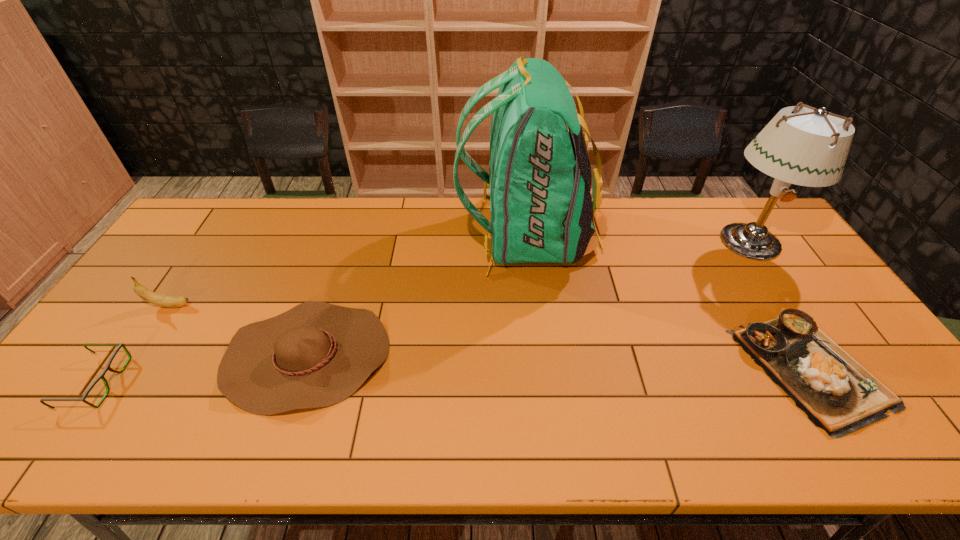
You are a GUI agent. You are given a task and a screenshot of the screen. Output one action in this format:
    pyautogui.click(x=<x>, y=<y>)
    Task: Click on the backpack
    
    Given the screenshot: What is the action you would take?
    pyautogui.click(x=541, y=209)

The image size is (960, 540). What are the coordinates of `the third object from right to left` in the screenshot? It's located at (541, 209).

Locate an element on the screen. the second tallest object is located at coordinates (809, 148).

Image resolution: width=960 pixels, height=540 pixels. In order to click on banana in this screenshot , I will do `click(157, 299)`.

At what (x,y) coordinates should I click in order to perform the action: click on the third object from left to right. Please return your answer as a coordinate pair (x, y). Looking at the image, I should click on (317, 354).

You are a GUI agent. You are given a task and a screenshot of the screen. Output one action in this format:
    pyautogui.click(x=<x>, y=<y>)
    Task: Click on the cowboy hat
    
    Given the screenshot: What is the action you would take?
    pyautogui.click(x=317, y=354)

This screenshot has width=960, height=540. Identify the location of platter. (837, 394).

The width and height of the screenshot is (960, 540). I want to click on spectacles, so click(101, 376).

Locate an element on the screen. This screenshot has width=960, height=540. blank space located on the back of the tallest object is located at coordinates (417, 236).

What are the coordinates of `vacant region located 0.100m on the back of the tallest object` in the screenshot? It's located at (428, 236).